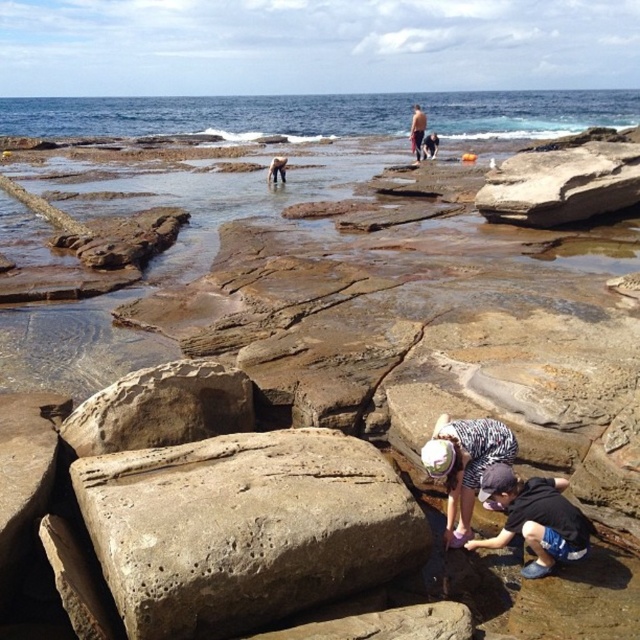
You are standing at the origin point of the image coordinate system. Where is the dark gray stone figure at center located?

The dark gray stone figure at center is located at point 0.266 on the x axis and 0.433 on the y axis.